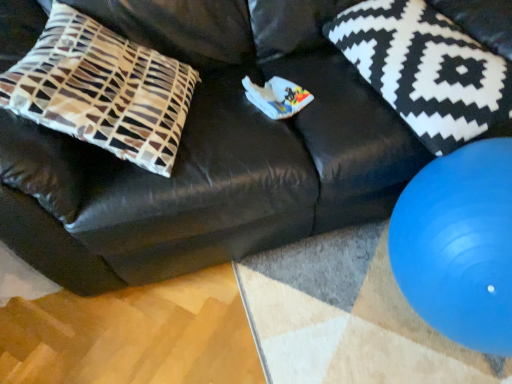
At what (x,y) coordinates should I click in order to perform the action: click on black and white patterned pillow at upper right, the first pillow from the right. Please return your answer as a coordinate pair (x, y). Looking at the image, I should click on (425, 69).

Which object is wider, brown and white patterned pillow at left, the 2th pillow from the right, or blue rubber ball at lower right?

brown and white patterned pillow at left, the 2th pillow from the right, is wider.

Which is more to the left, brown and white patterned pillow at left, the 2th pillow from the right, or blue rubber ball at lower right?

brown and white patterned pillow at left, the 2th pillow from the right, is more to the left.

Considering the sizes of brown and white patterned pillow at left, which ranks as the 1th pillow in left-to-right order, and blue rubber ball at lower right in the image, is brown and white patterned pillow at left, which ranks as the 1th pillow in left-to-right order, bigger or smaller than blue rubber ball at lower right?

Clearly, brown and white patterned pillow at left, which ranks as the 1th pillow in left-to-right order, is larger in size than blue rubber ball at lower right.

From a real-world perspective, is brown and white patterned pillow at left, the 2th pillow from the right, positioned above or below blue rubber ball at lower right?

brown and white patterned pillow at left, the 2th pillow from the right, is above blue rubber ball at lower right.

Does black and white patterned pillow at upper right, the first pillow from the right, have a lesser width compared to brown and white patterned pillow at left, which ranks as the 1th pillow in left-to-right order?

In fact, black and white patterned pillow at upper right, the first pillow from the right, might be wider than brown and white patterned pillow at left, which ranks as the 1th pillow in left-to-right order.

Where is `pillow lying behind the brown and white patterned pillow at left, which ranks as the 1th pillow in left-to-right order`? The height and width of the screenshot is (384, 512). pillow lying behind the brown and white patterned pillow at left, which ranks as the 1th pillow in left-to-right order is located at coordinates (425, 69).

How far apart are black and white patterned pillow at upper right, the first pillow from the right, and brown and white patterned pillow at left, the 2th pillow from the right?

A distance of 26.42 inches exists between black and white patterned pillow at upper right, the first pillow from the right, and brown and white patterned pillow at left, the 2th pillow from the right.

From a real-world perspective, is black and white patterned pillow at upper right, the 2th pillow positioned from the left, above or below brown and white patterned pillow at left, the 2th pillow from the right?

In terms of real-world spatial position, black and white patterned pillow at upper right, the 2th pillow positioned from the left, is below brown and white patterned pillow at left, the 2th pillow from the right.

How distant is blue rubber ball at lower right from black and white patterned pillow at upper right, the first pillow from the right?

A distance of 26.53 centimeters exists between blue rubber ball at lower right and black and white patterned pillow at upper right, the first pillow from the right.

From the image's perspective, is blue rubber ball at lower right positioned above or below black and white patterned pillow at upper right, the 2th pillow positioned from the left?

From the image's perspective, blue rubber ball at lower right appears below black and white patterned pillow at upper right, the 2th pillow positioned from the left.

Are blue rubber ball at lower right and black and white patterned pillow at upper right, the 2th pillow positioned from the left, beside each other?

No, blue rubber ball at lower right is not in contact with black and white patterned pillow at upper right, the 2th pillow positioned from the left.

Is blue rubber ball at lower right turned away from black and white patterned pillow at upper right, the 2th pillow positioned from the left?

That's right, blue rubber ball at lower right is facing away from black and white patterned pillow at upper right, the 2th pillow positioned from the left.

Find the location of a particular element. This screenshot has height=384, width=512. ball in front of the brown and white patterned pillow at left, the 2th pillow from the right is located at coordinates (459, 245).

From the image's perspective, which is above, blue rubber ball at lower right or brown and white patterned pillow at left, the 2th pillow from the right?

brown and white patterned pillow at left, the 2th pillow from the right, from the image's perspective.

Could you tell me if blue rubber ball at lower right is facing brown and white patterned pillow at left, which ranks as the 1th pillow in left-to-right order?

No, blue rubber ball at lower right is not facing towards brown and white patterned pillow at left, which ranks as the 1th pillow in left-to-right order.

Is blue rubber ball at lower right to the left or to the right of brown and white patterned pillow at left, which ranks as the 1th pillow in left-to-right order, in the image?

In the image, blue rubber ball at lower right appears on the right side of brown and white patterned pillow at left, which ranks as the 1th pillow in left-to-right order.

Considering the positions of objects brown and white patterned pillow at left, the 2th pillow from the right, and black and white patterned pillow at upper right, the first pillow from the right, in the image provided, who is more to the right, brown and white patterned pillow at left, the 2th pillow from the right, or black and white patterned pillow at upper right, the first pillow from the right,?

black and white patterned pillow at upper right, the first pillow from the right.

Measure the distance from brown and white patterned pillow at left, the 2th pillow from the right, to black and white patterned pillow at upper right, the 2th pillow positioned from the left.

They are 26.42 inches apart.

In terms of height, does brown and white patterned pillow at left, which ranks as the 1th pillow in left-to-right order, look taller or shorter compared to black and white patterned pillow at upper right, the first pillow from the right?

Clearly, brown and white patterned pillow at left, which ranks as the 1th pillow in left-to-right order, is taller compared to black and white patterned pillow at upper right, the first pillow from the right.

Is brown and white patterned pillow at left, which ranks as the 1th pillow in left-to-right order, wider than black and white patterned pillow at upper right, the 2th pillow positioned from the left?

No.

Is black and white patterned pillow at upper right, the first pillow from the right, with blue rubber ball at lower right?

black and white patterned pillow at upper right, the first pillow from the right, and blue rubber ball at lower right are clearly separated.

Would you say black and white patterned pillow at upper right, the 2th pillow positioned from the left, is inside or outside blue rubber ball at lower right?

black and white patterned pillow at upper right, the 2th pillow positioned from the left, cannot be found inside blue rubber ball at lower right.

How many degrees apart are the facing directions of black and white patterned pillow at upper right, the 2th pillow positioned from the left, and blue rubber ball at lower right?

The facing directions of black and white patterned pillow at upper right, the 2th pillow positioned from the left, and blue rubber ball at lower right are 8.71 degrees apart.

Which pillow is the 2nd one when counting from the left side of the blue rubber ball at lower right? Please provide its 2D coordinates.

[(102, 90)]

What are the coordinates of `pillow that appears above the black and white patterned pillow at upper right, the first pillow from the right (from a real-world perspective)` in the screenshot? It's located at (102, 90).

Which object lies further to the anchor point blue rubber ball at lower right, brown and white patterned pillow at left, which ranks as the 1th pillow in left-to-right order, or black and white patterned pillow at upper right, the 2th pillow positioned from the left?

brown and white patterned pillow at left, which ranks as the 1th pillow in left-to-right order.

Estimate the real-world distances between objects in this image. Which object is further from brown and white patterned pillow at left, the 2th pillow from the right, black and white patterned pillow at upper right, the first pillow from the right, or blue rubber ball at lower right?

Based on the image, blue rubber ball at lower right appears to be further to brown and white patterned pillow at left, the 2th pillow from the right.

Estimate the real-world distances between objects in this image. Which object is further from brown and white patterned pillow at left, the 2th pillow from the right, blue rubber ball at lower right or black and white patterned pillow at upper right, the 2th pillow positioned from the left?

Among the two, blue rubber ball at lower right is located further to brown and white patterned pillow at left, the 2th pillow from the right.

Which object lies further to the anchor point blue rubber ball at lower right, black and white patterned pillow at upper right, the first pillow from the right, or brown and white patterned pillow at left, the 2th pillow from the right?

Among the two, brown and white patterned pillow at left, the 2th pillow from the right, is located further to blue rubber ball at lower right.

Estimate the real-world distances between objects in this image. Which object is further from black and white patterned pillow at upper right, the first pillow from the right, blue rubber ball at lower right or brown and white patterned pillow at left, which ranks as the 1th pillow in left-to-right order?

brown and white patterned pillow at left, which ranks as the 1th pillow in left-to-right order, lies further to black and white patterned pillow at upper right, the first pillow from the right, than the other object.

When comparing their distances from black and white patterned pillow at upper right, the first pillow from the right, does brown and white patterned pillow at left, the 2th pillow from the right, or blue rubber ball at lower right seem closer?

The object closer to black and white patterned pillow at upper right, the first pillow from the right, is blue rubber ball at lower right.

Where is `pillow between brown and white patterned pillow at left, the 2th pillow from the right, and blue rubber ball at lower right from left to right`? The width and height of the screenshot is (512, 384). pillow between brown and white patterned pillow at left, the 2th pillow from the right, and blue rubber ball at lower right from left to right is located at coordinates (425, 69).